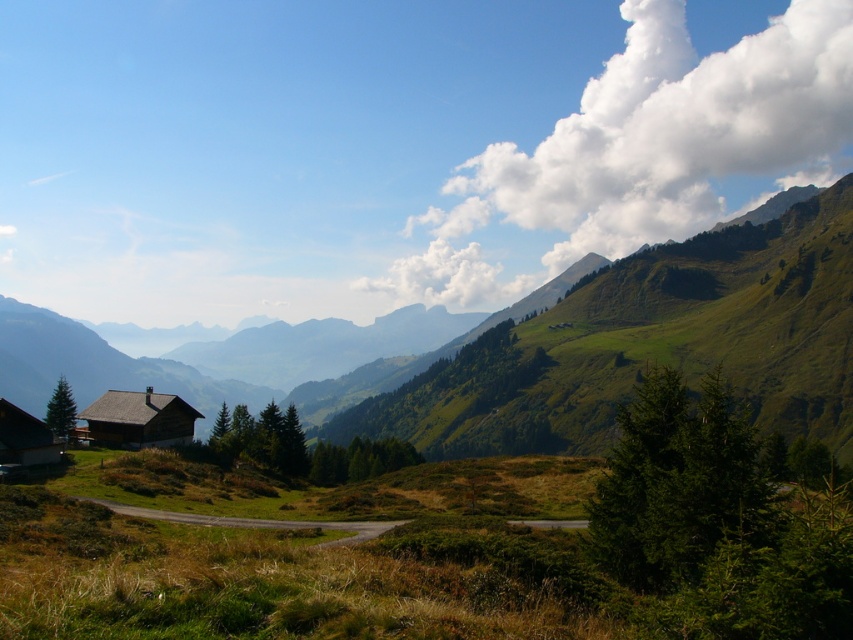
You are standing at the bottom of the mountain and want to reach the wooden cabin at center. According to the map, the cabin is located at coordinates 0.656, 0.164. Is the cabin closer to the top of the mountain or the bottom?

The wooden cabin at center is located at coordinates (138, 419). Since the coordinate system typically places (0, 0) at the bottom left corner and (852, 639) at the top right corner, the cabin is closer to the bottom of the mountain because its y coordinate is 0.164, which is closer to 0 than to 1.

You are standing at the point marked by the coordinate (138,419) in the image. Which object are you directly at?

You are directly at the wooden cabin at center, as the point (138,419) represents its location.